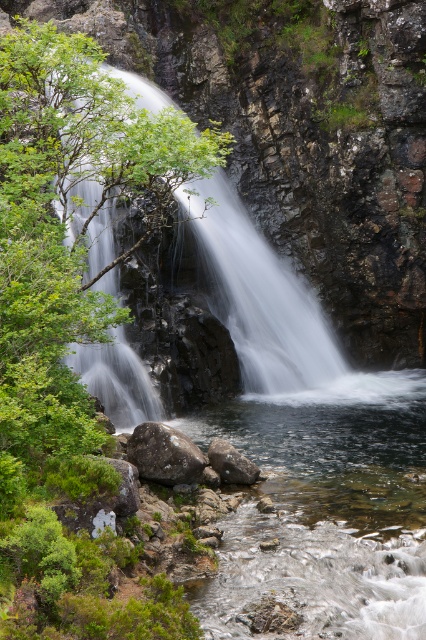
Question: Which of the following is the closest to the observer?

Choices:
 (A) green leafy tree at center
 (B) gray rough rock at lower center
 (C) green mossy rock at upper left

Answer: (A)

Question: Which object is positioned closest to the gray rough rock at lower center?

Choices:
 (A) green mossy rock at upper left
 (B) gray rock at center

Answer: (B)

Question: Which point is farther to the camera?

Choices:
 (A) gray rough rock at lower center
 (B) gray rock at center
 (C) green mossy rock at upper left
 (D) green leafy tree at center

Answer: (C)

Question: Is green leafy tree at center above gray rough rock at lower center?

Choices:
 (A) yes
 (B) no

Answer: (A)

Question: Does green mossy rock at upper left have a greater width compared to gray rock at center?

Choices:
 (A) no
 (B) yes

Answer: (A)

Question: Is green leafy tree at center smaller than green mossy rock at upper left?

Choices:
 (A) no
 (B) yes

Answer: (A)